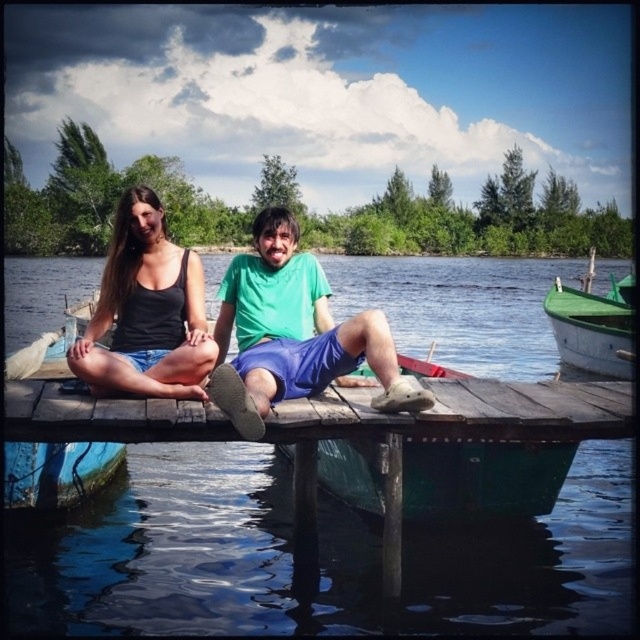
Question: Does green matte shirt at center appear over green wooden boat at right?

Choices:
 (A) no
 (B) yes

Answer: (A)

Question: Which object is closer to the camera taking this photo?

Choices:
 (A) matte black tank top at center
 (B) green matte shirt at center

Answer: (B)

Question: Estimate the real-world distances between objects in this image. Which object is closer to the transparent water at dock center?

Choices:
 (A) green matte shirt at center
 (B) green wooden boat at right

Answer: (B)

Question: Is green matte shirt at center to the right of green wooden boat at right from the viewer's perspective?

Choices:
 (A) yes
 (B) no

Answer: (B)

Question: Does green matte shirt at center have a greater width compared to matte black tank top at center?

Choices:
 (A) yes
 (B) no

Answer: (B)

Question: Which object is positioned farthest from the green wooden boat at right?

Choices:
 (A) green matte shirt at center
 (B) matte black tank top at center
 (C) transparent water at dock center

Answer: (B)